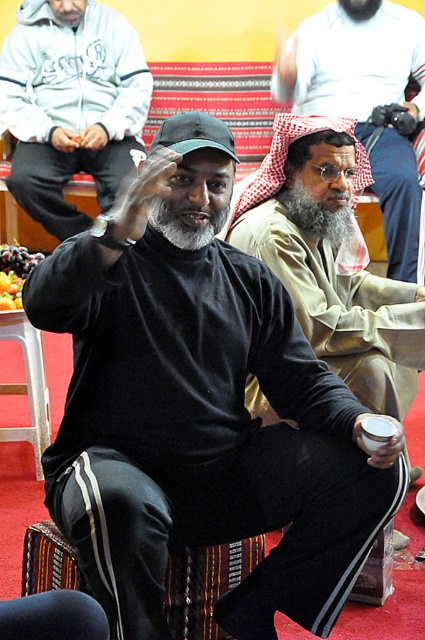
From the picture: How much distance is there between black matte turtleneck at center and beige textured robe at center?

The distance of black matte turtleneck at center from beige textured robe at center is 1.31 meters.

Who is positioned more to the left, black matte turtleneck at center or beige textured robe at center?

Positioned to the left is black matte turtleneck at center.

Is point (42, 68) farther from viewer compared to point (294, 44)?

Yes, it is.

I want to click on black matte turtleneck at center, so click(70, 104).

Is matte black sweater at center smaller than black matte turtleneck at center?

Indeed, matte black sweater at center has a smaller size compared to black matte turtleneck at center.

Does matte black sweater at center have a lesser width compared to black matte turtleneck at center?

Indeed, matte black sweater at center has a lesser width compared to black matte turtleneck at center.

This screenshot has height=640, width=425. Describe the element at coordinates (331, 259) in the screenshot. I see `matte black sweater at center` at that location.

I want to click on matte black sweater at center, so click(x=331, y=259).

Which is more to the right, matte black sweater at center or beige textured robe at center?

From the viewer's perspective, beige textured robe at center appears more on the right side.

Image resolution: width=425 pixels, height=640 pixels. Identify the location of matte black sweater at center. (331, 259).